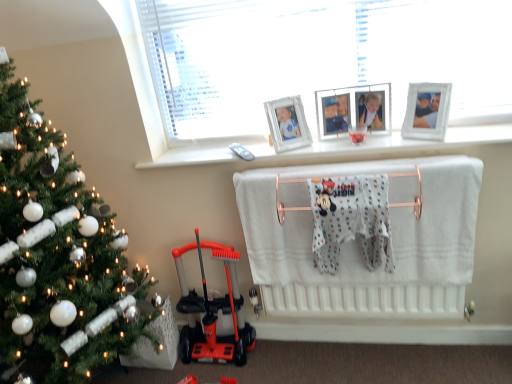
Question: Would you say green matte christmas tree at left contains white glass window at upper center?

Choices:
 (A) no
 (B) yes

Answer: (A)

Question: Is the position of green matte christmas tree at left less distant than that of white glass window at upper center?

Choices:
 (A) yes
 (B) no

Answer: (A)

Question: Does green matte christmas tree at left have a greater width compared to white glass window at upper center?

Choices:
 (A) no
 (B) yes

Answer: (B)

Question: Considering the relative sizes of green matte christmas tree at left and white glass window at upper center in the image provided, is green matte christmas tree at left smaller than white glass window at upper center?

Choices:
 (A) yes
 (B) no

Answer: (B)

Question: Is green matte christmas tree at left shorter than white glass window at upper center?

Choices:
 (A) no
 (B) yes

Answer: (A)

Question: Is green matte christmas tree at left to the left or to the right of white glass window at upper center in the image?

Choices:
 (A) left
 (B) right

Answer: (A)

Question: Is point (20, 195) positioned closer to the camera than point (118, 28)?

Choices:
 (A) closer
 (B) farther

Answer: (A)

Question: Is green matte christmas tree at left bigger or smaller than white glass window at upper center?

Choices:
 (A) big
 (B) small

Answer: (A)

Question: Is green matte christmas tree at left wider or thinner than white glass window at upper center?

Choices:
 (A) thin
 (B) wide

Answer: (B)

Question: Considering the positions of white fabric infant bed at center and white cotton bath towel at center in the image, is white fabric infant bed at center wider or thinner than white cotton bath towel at center?

Choices:
 (A) wide
 (B) thin

Answer: (B)

Question: Considering their positions, is white fabric infant bed at center located in front of or behind white cotton bath towel at center?

Choices:
 (A) behind
 (B) front

Answer: (A)

Question: Is point (266, 276) positioned closer to the camera than point (340, 180)?

Choices:
 (A) closer
 (B) farther

Answer: (B)

Question: Would you say white fabric infant bed at center is to the left or to the right of white cotton bath towel at center in the picture?

Choices:
 (A) left
 (B) right

Answer: (B)

Question: Considering the positions of green matte christmas tree at left and white wooden picture frame at upper center, the first picture frame from the left, in the image, is green matte christmas tree at left taller or shorter than white wooden picture frame at upper center, the first picture frame from the left,?

Choices:
 (A) short
 (B) tall

Answer: (B)

Question: From the image's perspective, is green matte christmas tree at left located above or below white wooden picture frame at upper center, the first picture frame from the left?

Choices:
 (A) above
 (B) below

Answer: (B)